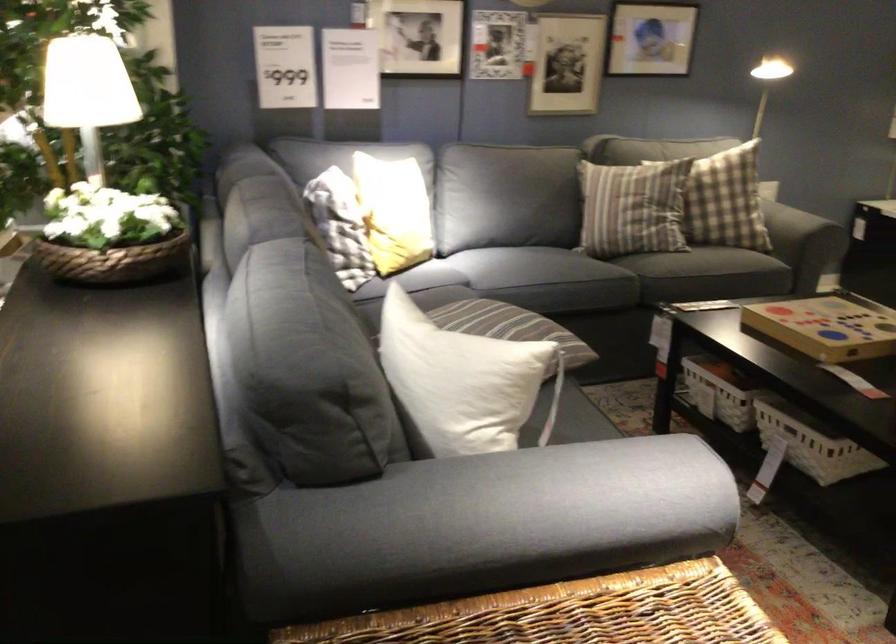
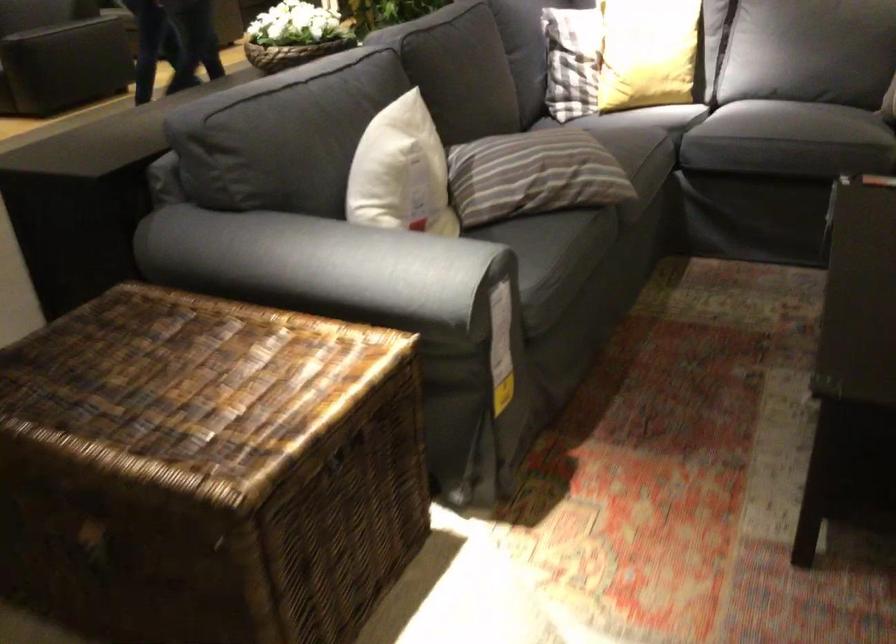
Locate, in the second image, the point that corresponds to the point at 168,243 in the first image.

(291, 53)